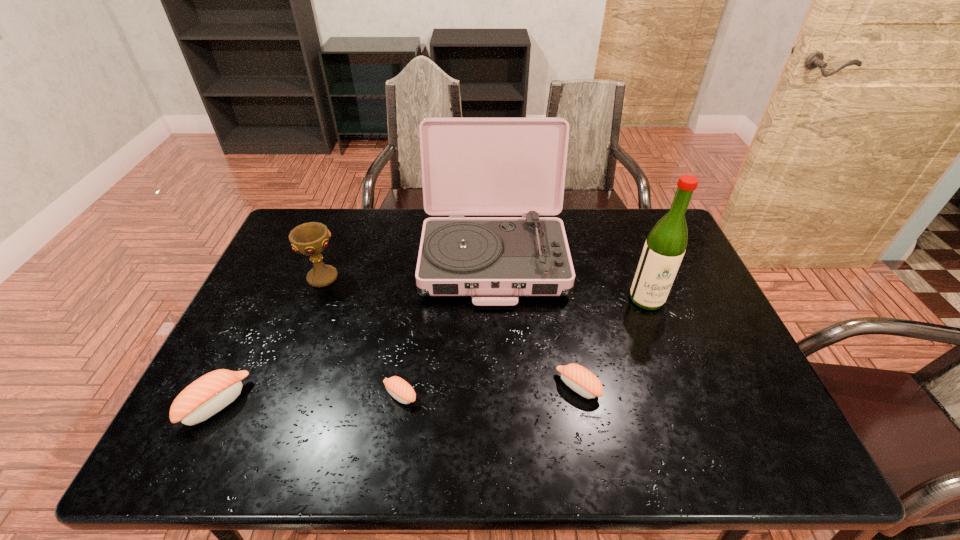
Identify the location of the fourth tallest object. (206, 396).

Locate an element on the screen. Image resolution: width=960 pixels, height=540 pixels. the leftmost object is located at coordinates (206, 396).

Locate an element on the screen. The image size is (960, 540). the shortest sushi is located at coordinates (398, 388).

Find the location of a particular element. Image resolution: width=960 pixels, height=540 pixels. the second sushi from left to right is located at coordinates (398, 388).

At what (x,y) coordinates should I click in order to perform the action: click on the second shortest object. Please return your answer as a coordinate pair (x, y). The height and width of the screenshot is (540, 960). Looking at the image, I should click on point(582,381).

The height and width of the screenshot is (540, 960). Identify the location of the rightmost sushi. [582, 381].

This screenshot has width=960, height=540. Identify the location of record player. (470, 166).

At what (x,y) coordinates should I click in order to perform the action: click on the second object from left to right. Please return your answer as a coordinate pair (x, y). Image resolution: width=960 pixels, height=540 pixels. Looking at the image, I should click on coord(310,239).

Find the location of a particular element. Image resolution: width=960 pixels, height=540 pixels. chalice is located at coordinates point(310,239).

Locate an element on the screen. liquor is located at coordinates (666, 243).